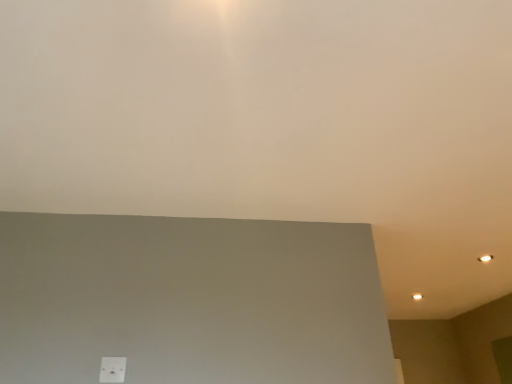
What do you see at coordinates (112, 370) in the screenshot? I see `white plastic light switch at lower left` at bounding box center [112, 370].

You are a GUI agent. You are given a task and a screenshot of the screen. Output one action in this format:
    pyautogui.click(x=<x>, y=<y>)
    Task: Click on the white plastic light switch at lower left
    
    Given the screenshot: What is the action you would take?
    pyautogui.click(x=112, y=370)

Locate an element on the screen. white plastic light switch at lower left is located at coordinates [x=112, y=370].